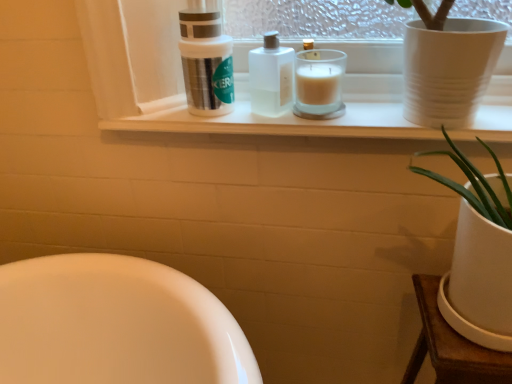
This screenshot has height=384, width=512. Find the location of `vacant space in front of clear plastic bottle at center`. vacant space in front of clear plastic bottle at center is located at coordinates (279, 126).